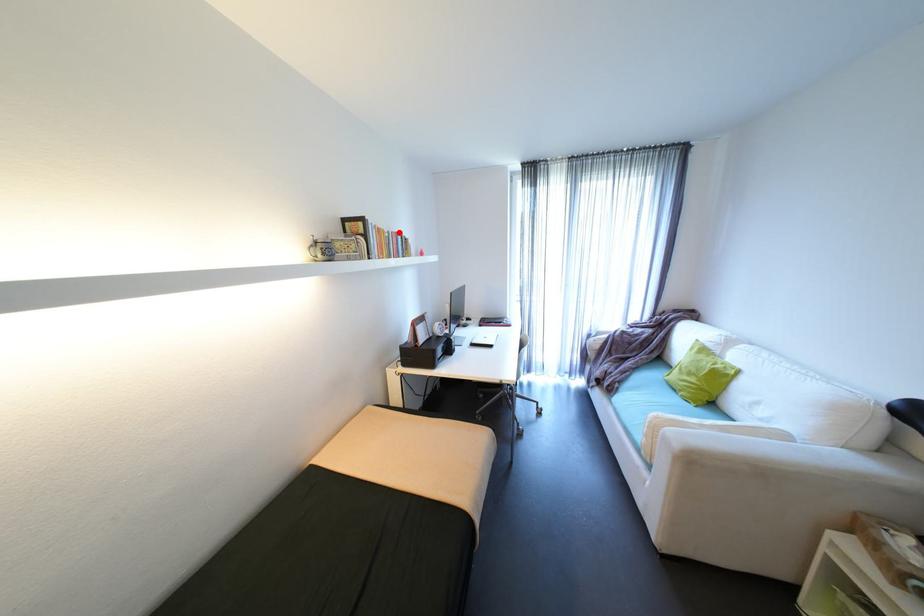
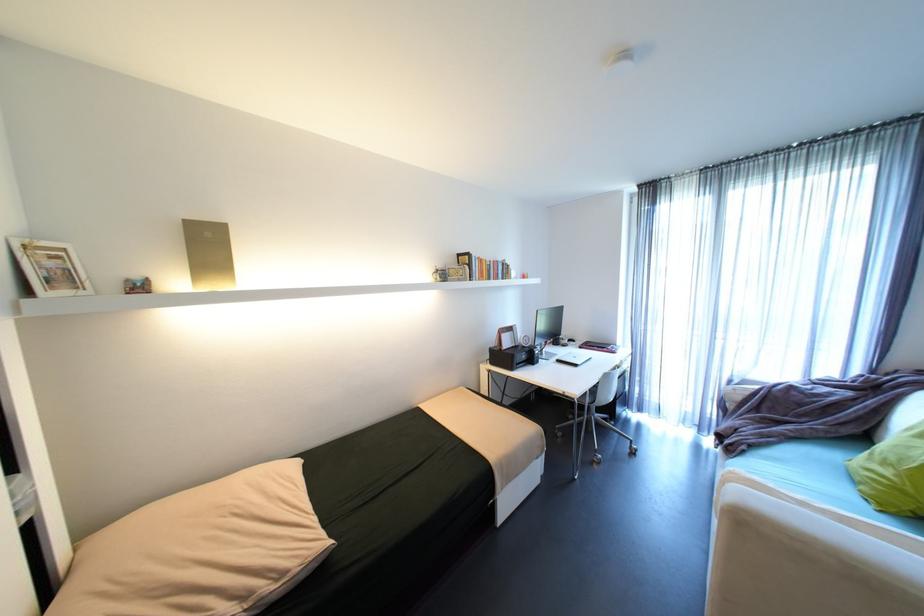
Question: I am providing you with two images of the same scene from different viewpoints. A red point is marked on the first image. Is the red point's position out of view in image 2?

Choices:
 (A) Yes
 (B) No

Answer: (B)